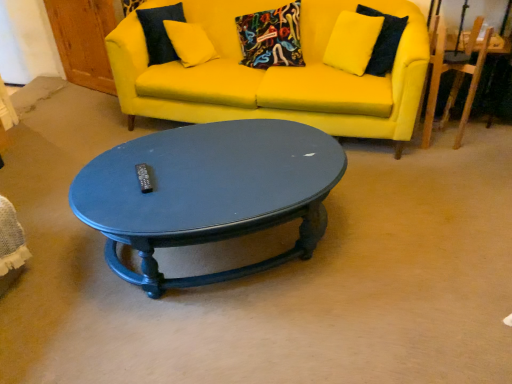
Question: In terms of height, does glossy dark blue coffee table at center look taller or shorter compared to matte yellow fabric couch at upper center?

Choices:
 (A) tall
 (B) short

Answer: (B)

Question: Would you say glossy dark blue coffee table at center is to the left or to the right of matte yellow fabric couch at upper center in the picture?

Choices:
 (A) right
 (B) left

Answer: (B)

Question: Based on their relative distances, which object is nearer to the wooden armchair at right?

Choices:
 (A) glossy dark blue coffee table at center
 (B) matte yellow fabric couch at upper center

Answer: (B)

Question: Which is nearer to the matte yellow fabric couch at upper center?

Choices:
 (A) wooden armchair at right
 (B) glossy dark blue coffee table at center

Answer: (A)